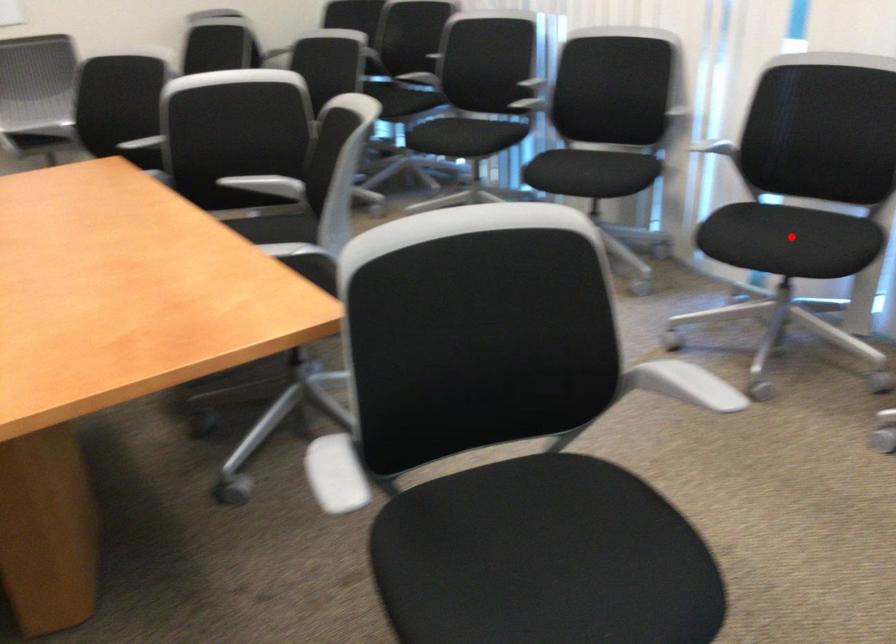
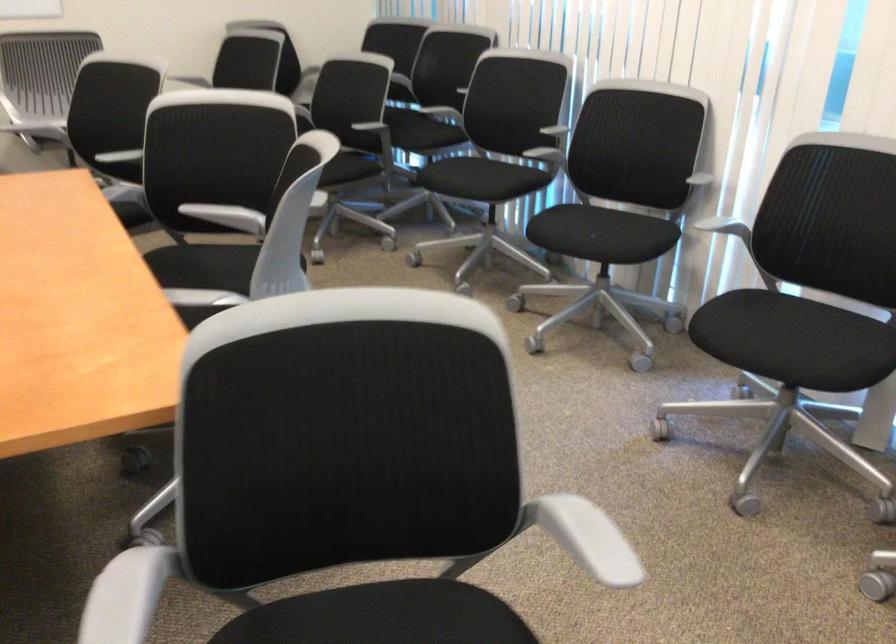
In the second image, find the point that corresponds to the highlighted location in the first image.

(795, 342)